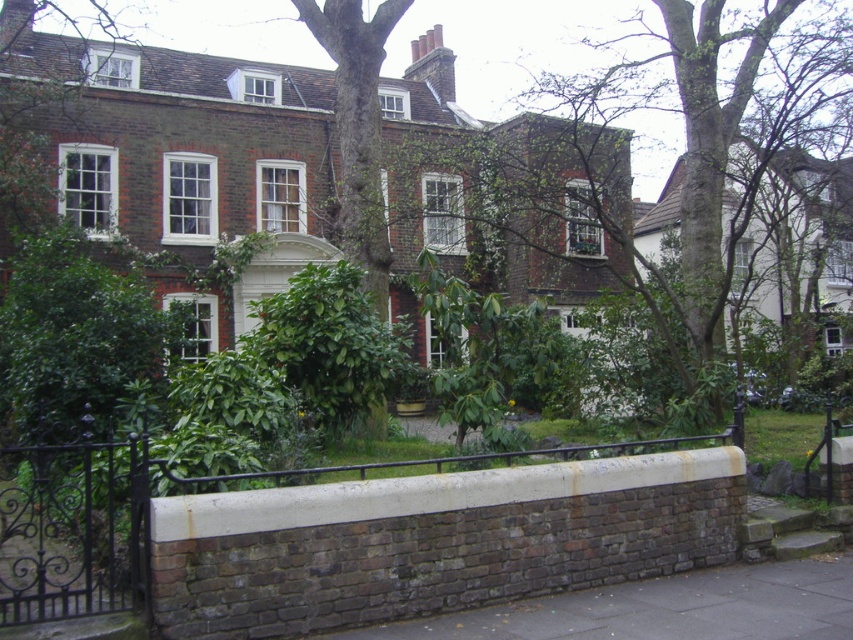
Question: Which point appears closest to the camera in this image?

Choices:
 (A) (622, 625)
 (B) (144, 540)

Answer: (B)

Question: Which object is closer to the camera taking this photo?

Choices:
 (A) rusty brick wall at lower center
 (B) brown brick pavement at lower center

Answer: (B)

Question: Does rusty brick wall at lower center have a lesser width compared to brown brick pavement at lower center?

Choices:
 (A) yes
 (B) no

Answer: (A)

Question: Is rusty brick wall at lower center to the right of brown brick pavement at lower center from the viewer's perspective?

Choices:
 (A) no
 (B) yes

Answer: (A)

Question: Can you confirm if rusty brick wall at lower center is bigger than brown brick pavement at lower center?

Choices:
 (A) yes
 (B) no

Answer: (B)